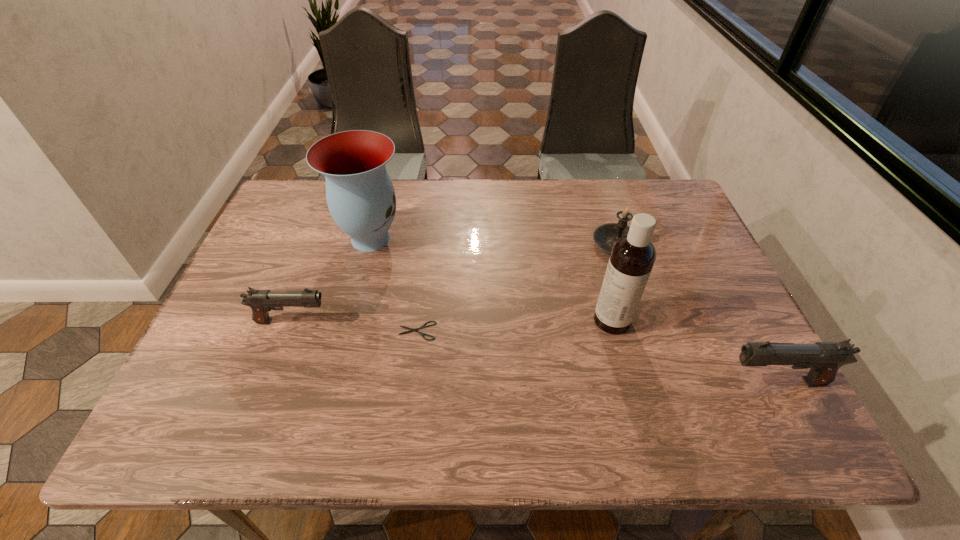
To achieve even spacing by inserting another gun among them, please point to a vacant spot for this new gun. Please provide its 2D coordinates. Your answer should be formatted as a tuple, i.e. [(x, y)], where the tuple contains the x and y coordinates of a point satisfying the conditions above.

[(520, 350)]